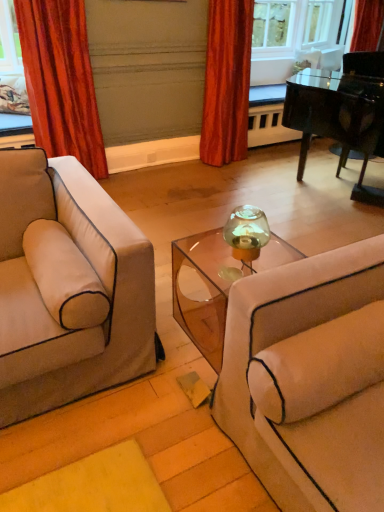
Question: Considering the relative sizes of beige fabric pillow at right and transparent acrylic table at center in the image provided, is beige fabric pillow at right thinner than transparent acrylic table at center?

Choices:
 (A) yes
 (B) no

Answer: (A)

Question: Is beige fabric pillow at right positioned far away from transparent acrylic table at center?

Choices:
 (A) no
 (B) yes

Answer: (A)

Question: Would you say beige fabric pillow at right is outside transparent acrylic table at center?

Choices:
 (A) no
 (B) yes

Answer: (B)

Question: Is beige fabric pillow at right bigger than transparent acrylic table at center?

Choices:
 (A) yes
 (B) no

Answer: (B)

Question: Is beige fabric pillow at right at the left side of transparent acrylic table at center?

Choices:
 (A) yes
 (B) no

Answer: (B)

Question: Does beige fabric pillow at right have a greater height compared to transparent acrylic table at center?

Choices:
 (A) yes
 (B) no

Answer: (B)

Question: Are beige fabric pillow at right and shiny black piano at upper right far apart?

Choices:
 (A) yes
 (B) no

Answer: (A)

Question: From the image's perspective, is beige fabric pillow at right below shiny black piano at upper right?

Choices:
 (A) no
 (B) yes

Answer: (B)

Question: Does beige fabric pillow at right appear on the right side of shiny black piano at upper right?

Choices:
 (A) no
 (B) yes

Answer: (A)

Question: Is beige fabric pillow at right taller than shiny black piano at upper right?

Choices:
 (A) no
 (B) yes

Answer: (A)

Question: Does beige fabric pillow at right have a greater width compared to shiny black piano at upper right?

Choices:
 (A) no
 (B) yes

Answer: (A)

Question: Considering the relative positions of beige fabric pillow at right and shiny black piano at upper right in the image provided, is beige fabric pillow at right behind shiny black piano at upper right?

Choices:
 (A) yes
 (B) no

Answer: (B)

Question: Considering the relative positions of velvet orange curtain at left, marked as the second curtain in a right-to-left arrangement, and beige fabric pillow at right in the image provided, is velvet orange curtain at left, marked as the second curtain in a right-to-left arrangement, in front of beige fabric pillow at right?

Choices:
 (A) yes
 (B) no

Answer: (B)